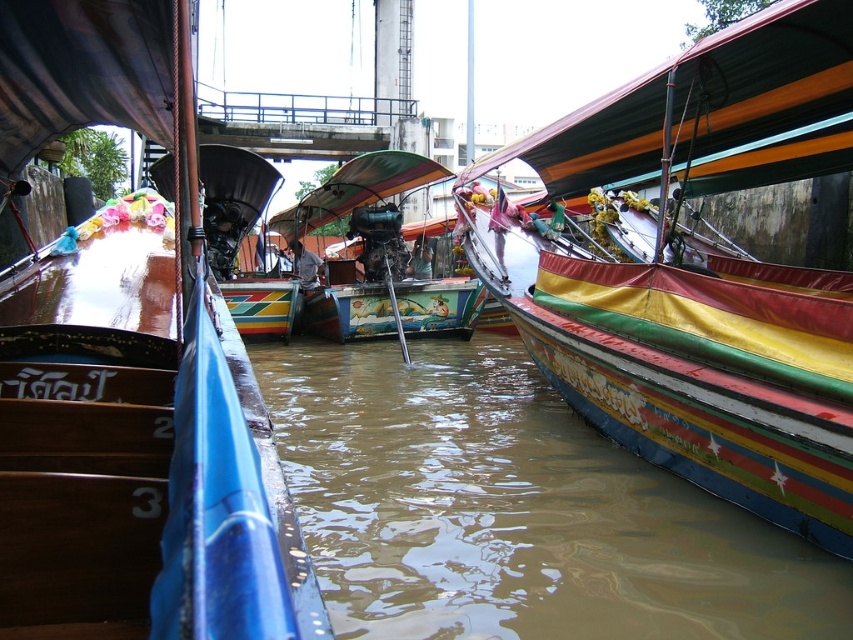
Question: Is brown murky water at center to the right of wooden boat at left from the viewer's perspective?

Choices:
 (A) yes
 (B) no

Answer: (A)

Question: Which of these objects is positioned farthest from the brown murky water at center?

Choices:
 (A) painted wooden boat at center
 (B) multicolored painted boat at center
 (C) wooden boat at left

Answer: (A)

Question: Which of the following is the farthest from the observer?

Choices:
 (A) painted wooden boat at center
 (B) wooden boat at left
 (C) multicolored painted boat at center

Answer: (A)

Question: Which of the following is the closest to the observer?

Choices:
 (A) brown murky water at center
 (B) wooden boat at left

Answer: (B)

Question: Is wooden boat at left behind painted wooden boat at center?

Choices:
 (A) yes
 (B) no

Answer: (B)

Question: Can you confirm if wooden boat at left is wider than painted wooden boat at center?

Choices:
 (A) yes
 (B) no

Answer: (A)